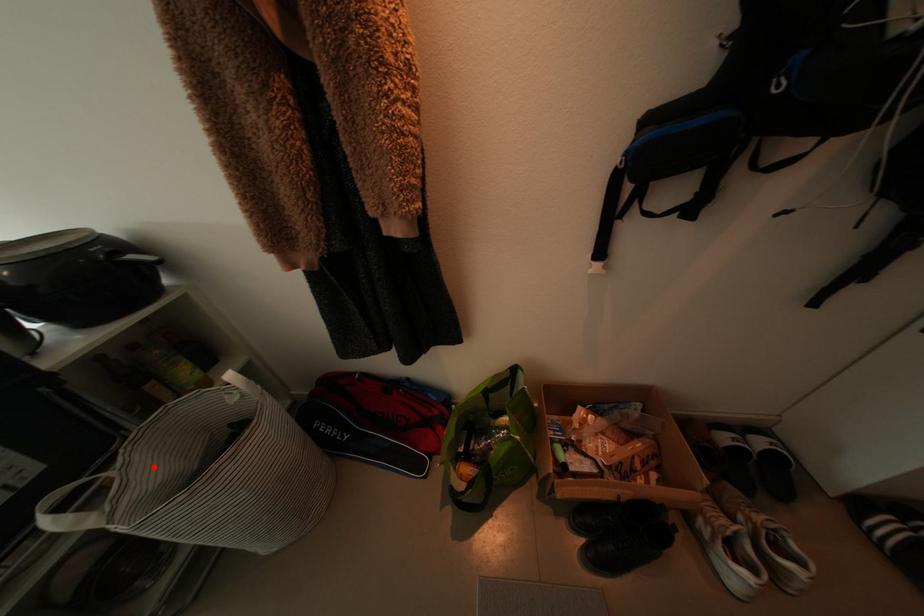
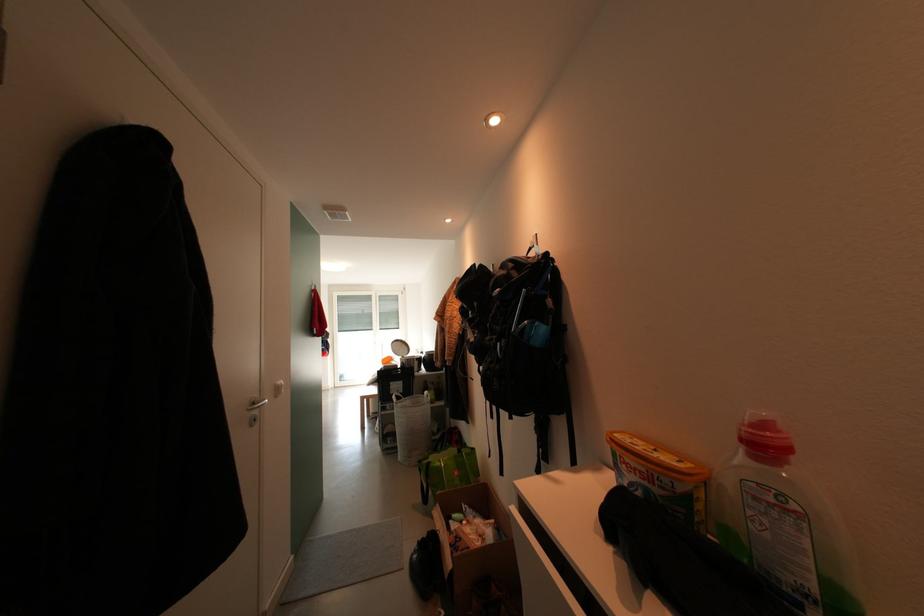
In the second image, find the point that corresponds to the highlighted location in the first image.

(415, 405)